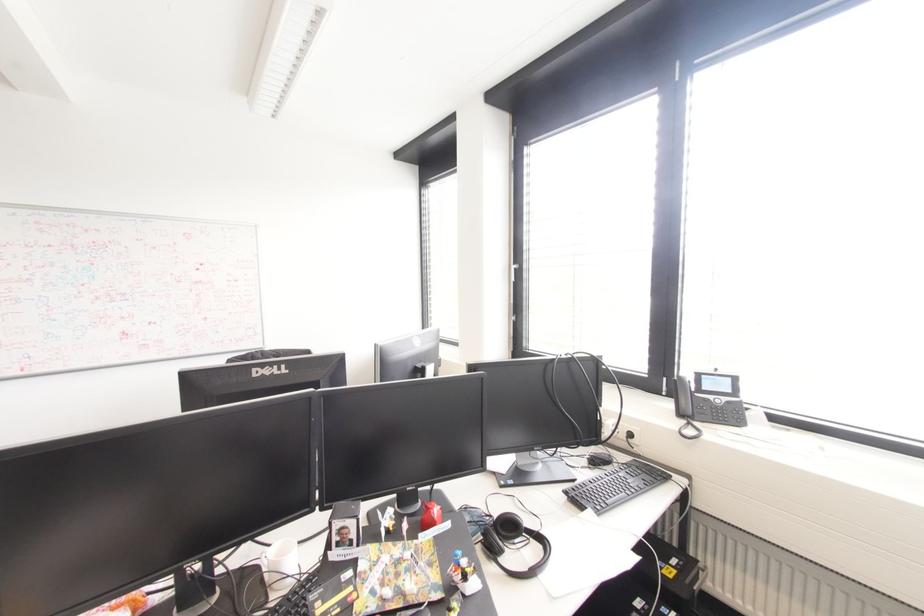
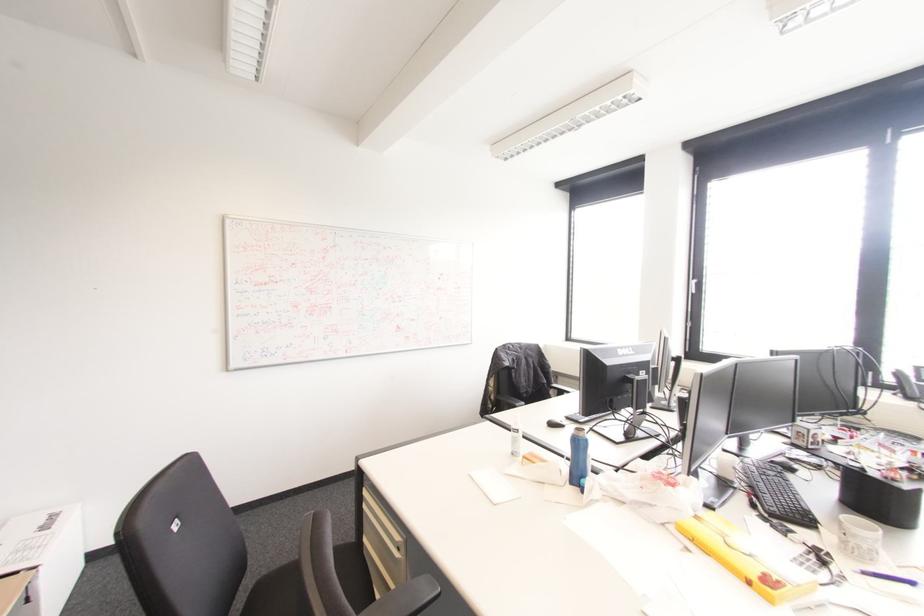
The images are taken continuously from a first-person perspective. In which direction are you moving?

The cameraman walked toward left, backward.